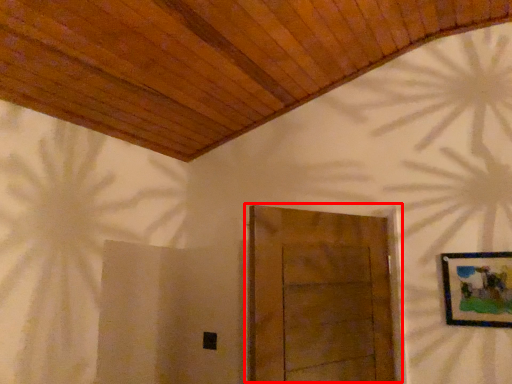
Question: From the image's perspective, where is door (annotated by the red box) located in relation to picture frame in the image?

Choices:
 (A) above
 (B) below

Answer: (B)